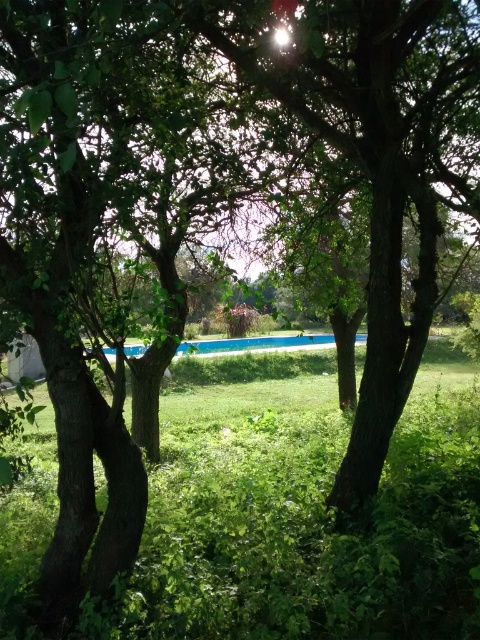
You are standing at the edge of the scene and want to walk to the blue smooth pool at center. However, there is green leafy grass at center in your path. Can you step over the grass to reach the pool?

The green leafy grass at center is positioned under the blue smooth pool at center, so stepping over the grass would allow you to reach the pool.